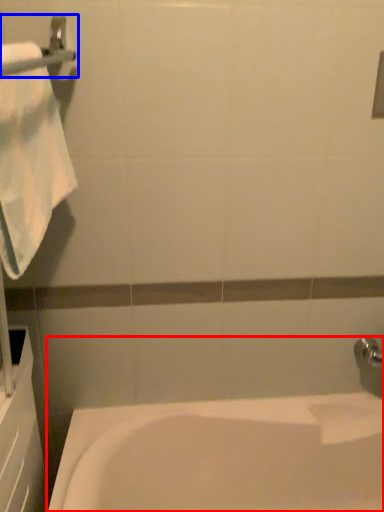
Question: Which of the following is the farthest to the observer, bathtub (highlighted by a red box) or towel bar (highlighted by a blue box)?

Choices:
 (A) bathtub
 (B) towel bar

Answer: (A)